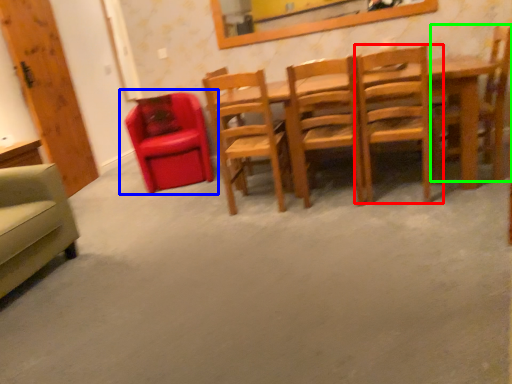
Question: Which is farther away from chair (highlighted by a red box)? chair (highlighted by a blue box) or chair (highlighted by a green box)?

Choices:
 (A) chair
 (B) chair

Answer: (A)